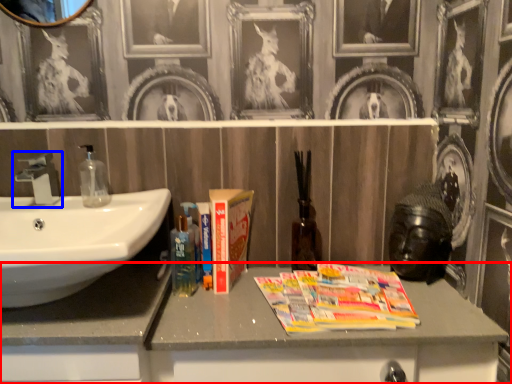
Question: Which object appears closest to the camera in this image, bathroom cabinet (highlighted by a red box) or tap (highlighted by a blue box)?

Choices:
 (A) bathroom cabinet
 (B) tap

Answer: (A)